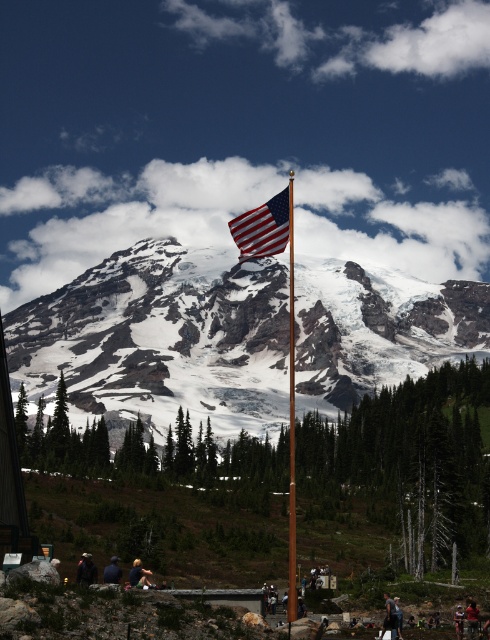
You are a photographer planning to take a portrait of someone wearing a red shirt at center and dark blue fabric at lower center. Which object is closer to the camera?

The red shirt at center is closer to the camera because the dark blue fabric at lower center is behind it.

You are a photographer planning to capture a landscape photo that includes both the dark blue jeans at lower right and the red shirt at center. Which object should you focus on first if you want to ensure both are in sharp focus?

The dark blue jeans at lower right is much taller than the red shirt at center, so focusing on the dark blue jeans at lower right will help ensure both are in sharp focus.

What is the location of the point with coordinates (161, 339) in the image?

The point with coordinates (161, 339) is located on the snowy granite mountain at center.